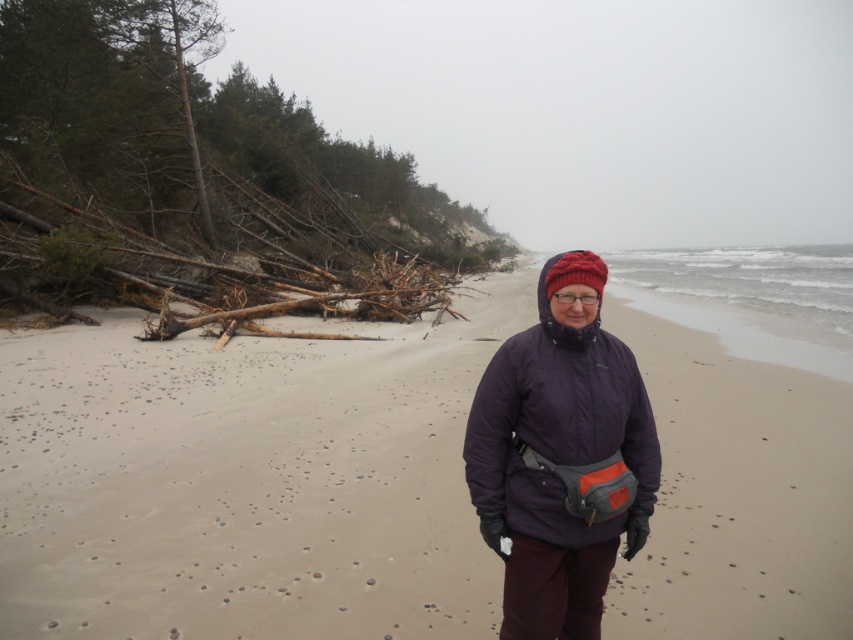
In the scene shown: You are a photographer trying to capture the person in the purple synthetic jacket at center while ensuring the smooth sand at center is visible in the background. Based on their positions, which direction should you move your camera to include both the person and the sand in the frame?

Since the smooth sand at center is to the left of the purple synthetic jacket at center, you should move your camera slightly to the right to include both the person and the sand in the frame.

You are a photographer wanting to capture the entire scene of the smooth sand at center and the purple synthetic jacket at center in one shot. Given that the camera can only focus on objects within a 1.5 meter width, will you need to adjust your position to ensure both are fully visible?

The smooth sand at center is wider than the purple synthetic jacket at center. Since the camera can focus on objects within a 1.5 meter width, you need to check if both objects can fit within that width. However, the description only mentions the sand is wider than the jacket, but doesn not specify exact measurements. Without knowing the exact width of the sand or jacket, it is uncertain if they can both fit within the 1.5 meter limit. Adjust your position to ensure both are within the camera frame.